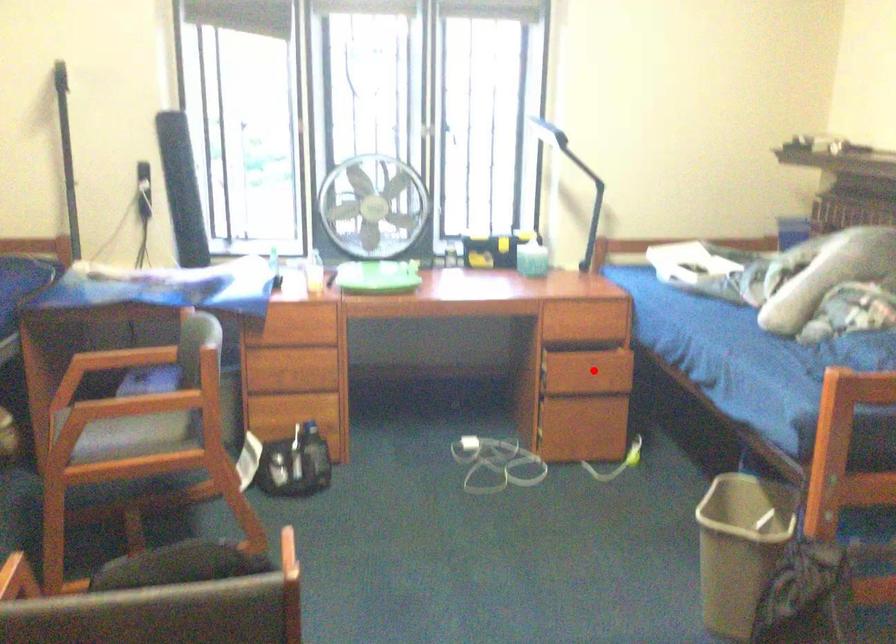
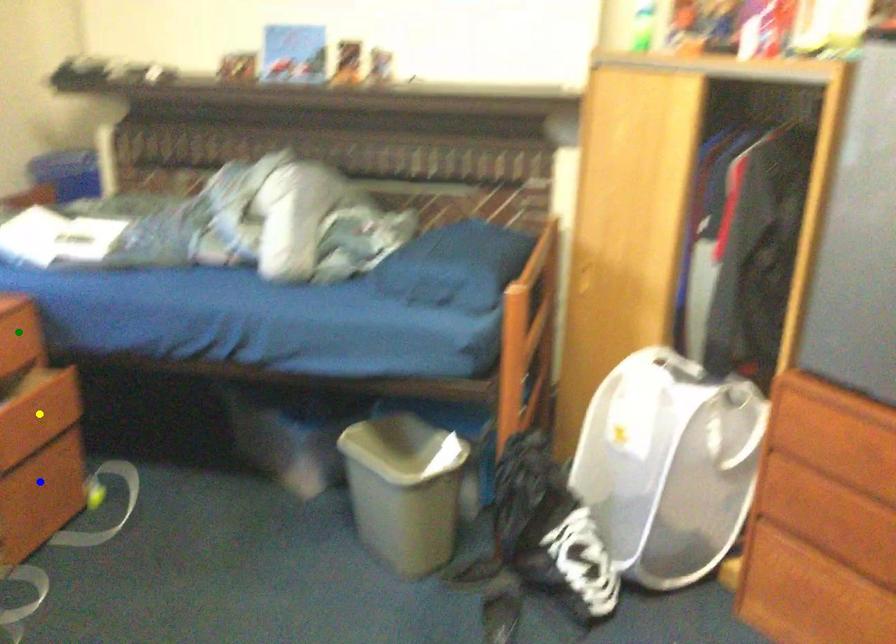
Question: I am providing you with two images of the same scene from different viewpoints. A red point is marked on the first image. You are given multiple points on the second image. In image 2, which mark is for the same physical point as the one in image 1?

Choices:
 (A) yellow point
 (B) blue point
 (C) green point

Answer: (A)